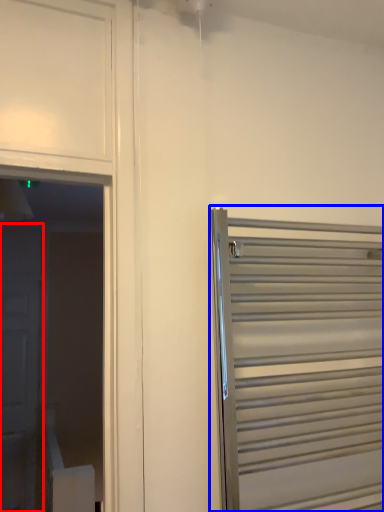
Question: Which object is closer to the camera taking this photo, door (highlighted by a red box) or door (highlighted by a blue box)?

Choices:
 (A) door
 (B) door

Answer: (B)